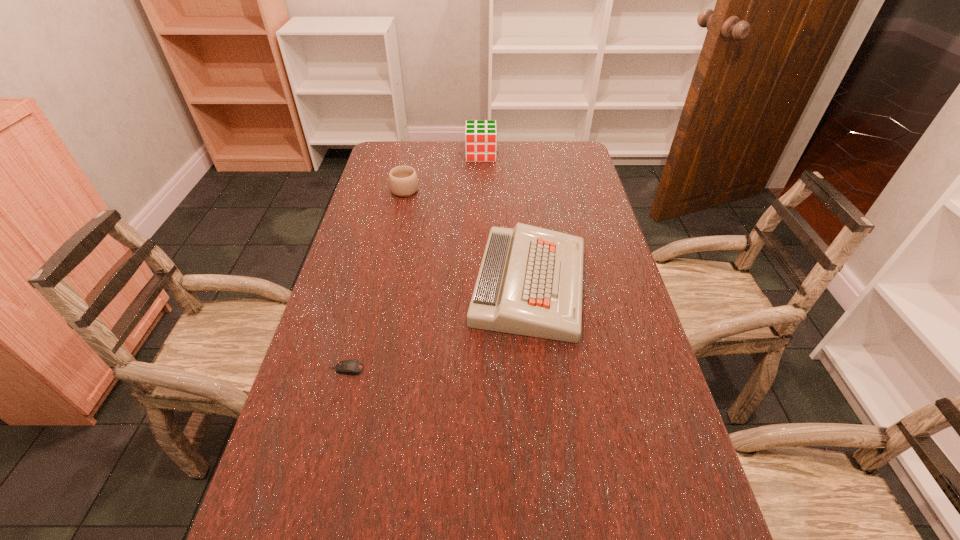
This screenshot has height=540, width=960. What are the coordinates of `the tallest object` in the screenshot? It's located at (480, 135).

The image size is (960, 540). I want to click on cube, so click(x=480, y=135).

You are a GUI agent. You are given a task and a screenshot of the screen. Output one action in this format:
    pyautogui.click(x=<x>, y=<y>)
    Task: Click on the third nearest object
    The image size is (960, 540).
    Given the screenshot: What is the action you would take?
    point(403,180)

Where is `the second nearest object`? This screenshot has height=540, width=960. the second nearest object is located at coordinates 530,282.

Identify the location of the shortest object. The width and height of the screenshot is (960, 540). (349, 367).

The height and width of the screenshot is (540, 960). In order to click on computer mouse in this screenshot , I will do `click(349, 367)`.

In order to click on vacant point located on the red face of the farthest object in this screenshot , I will do `click(481, 206)`.

The width and height of the screenshot is (960, 540). Find the location of `vacant position located on the side of the mug with the handle`. vacant position located on the side of the mug with the handle is located at coordinates (413, 156).

Image resolution: width=960 pixels, height=540 pixels. In order to click on blank space located on the side of the mug with the handle in this screenshot , I will do `click(416, 141)`.

Locate an element on the screen. This screenshot has height=540, width=960. free point located 0.190m on the side of the mug with the handle is located at coordinates (413, 153).